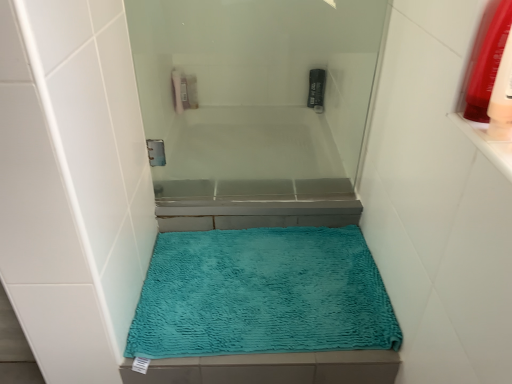
Question: Is teal plush bath mat at center placed right next to black plastic mouthwash at upper center, placed as the 1th mouthwash when sorted from top to bottom?

Choices:
 (A) no
 (B) yes

Answer: (A)

Question: Considering the relative sizes of teal plush bath mat at center and black plastic mouthwash at upper center, which appears as the second mouthwash when viewed from the right, in the image provided, is teal plush bath mat at center smaller than black plastic mouthwash at upper center, which appears as the second mouthwash when viewed from the right,?

Choices:
 (A) no
 (B) yes

Answer: (A)

Question: Considering the relative positions of teal plush bath mat at center and black plastic mouthwash at upper center, which is the 1th mouthwash from back to front, in the image provided, is teal plush bath mat at center behind black plastic mouthwash at upper center, which is the 1th mouthwash from back to front,?

Choices:
 (A) yes
 (B) no

Answer: (B)

Question: Does teal plush bath mat at center appear on the right side of black plastic mouthwash at upper center, placed as the 1th mouthwash when sorted from top to bottom?

Choices:
 (A) yes
 (B) no

Answer: (B)

Question: From the image's perspective, is teal plush bath mat at center over black plastic mouthwash at upper center, acting as the 1th mouthwash starting from the left?

Choices:
 (A) no
 (B) yes

Answer: (A)

Question: Is point (323, 82) positioned closer to the camera than point (236, 352)?

Choices:
 (A) farther
 (B) closer

Answer: (A)

Question: Considering the relative positions of black plastic mouthwash at upper center, which ranks as the second mouthwash in bottom-to-top order, and teal plush bath mat at center in the image provided, is black plastic mouthwash at upper center, which ranks as the second mouthwash in bottom-to-top order, to the left or to the right of teal plush bath mat at center?

Choices:
 (A) right
 (B) left

Answer: (A)

Question: Looking at their shapes, would you say black plastic mouthwash at upper center, which ranks as the second mouthwash in bottom-to-top order, is wider or thinner than teal plush bath mat at center?

Choices:
 (A) thin
 (B) wide

Answer: (A)

Question: Relative to teal plush bath mat at center, is black plastic mouthwash at upper center, acting as the 1th mouthwash starting from the left, in front or behind?

Choices:
 (A) behind
 (B) front

Answer: (A)

Question: Considering the positions of black plastic mouthwash at upper center, the 2th mouthwash in the front-to-back sequence, and transparent glass screen door at upper center in the image, is black plastic mouthwash at upper center, the 2th mouthwash in the front-to-back sequence, wider or thinner than transparent glass screen door at upper center?

Choices:
 (A) wide
 (B) thin

Answer: (A)

Question: Looking at the image, does black plastic mouthwash at upper center, which is the 1th mouthwash from back to front, seem bigger or smaller compared to transparent glass screen door at upper center?

Choices:
 (A) big
 (B) small

Answer: (B)

Question: Is black plastic mouthwash at upper center, placed as the 1th mouthwash when sorted from top to bottom, inside the boundaries of transparent glass screen door at upper center, or outside?

Choices:
 (A) outside
 (B) inside

Answer: (A)

Question: Considering the positions of black plastic mouthwash at upper center, acting as the 1th mouthwash starting from the left, and transparent glass screen door at upper center in the image, is black plastic mouthwash at upper center, acting as the 1th mouthwash starting from the left, taller or shorter than transparent glass screen door at upper center?

Choices:
 (A) tall
 (B) short

Answer: (B)

Question: From their relative heights in the image, would you say transparent glass screen door at upper center is taller or shorter than translucent plastic mouthwash at upper right, which appears as the second mouthwash when viewed from the left?

Choices:
 (A) tall
 (B) short

Answer: (A)

Question: Would you say transparent glass screen door at upper center is to the left or to the right of translucent plastic mouthwash at upper right, marked as the 2th mouthwash in a top-to-bottom arrangement, in the picture?

Choices:
 (A) left
 (B) right

Answer: (A)